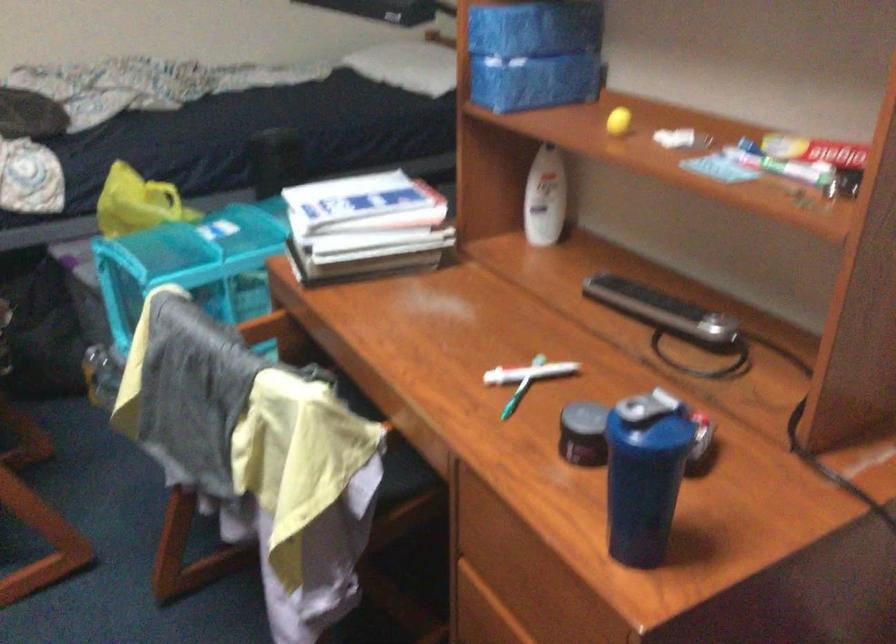
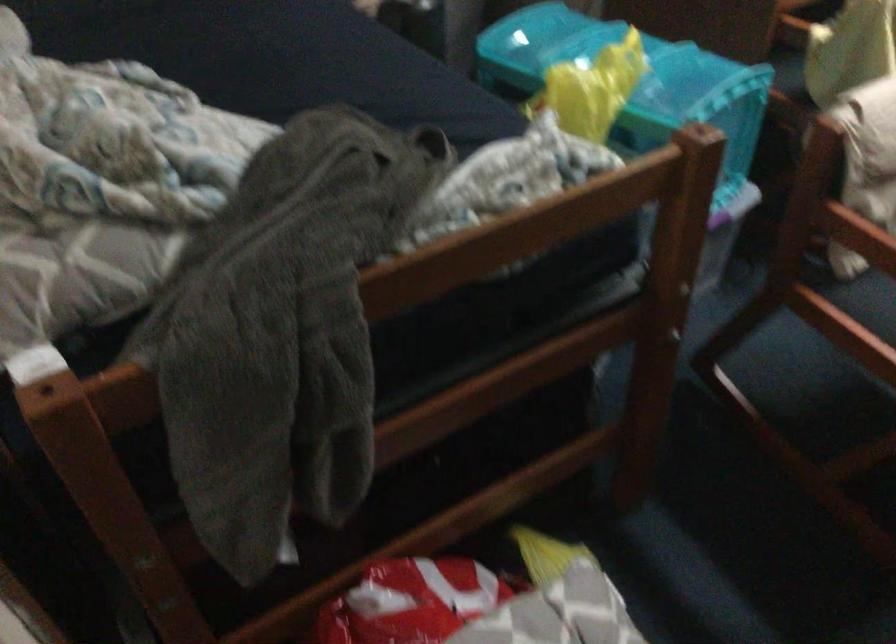
Find the pixel in the second image that matches point 152,185 in the first image.

(600, 62)